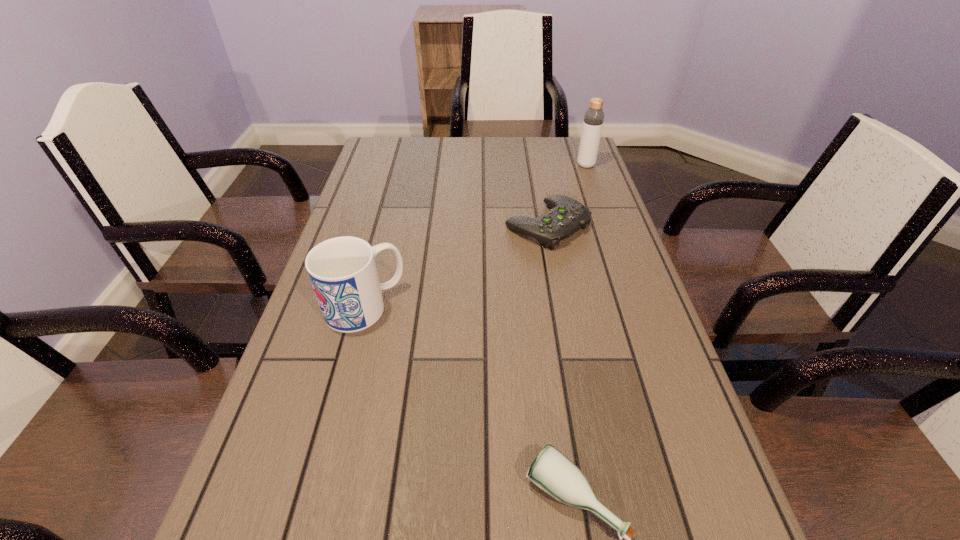
Find the location of a particular element. This screenshot has height=540, width=960. object present at the left edge is located at coordinates (342, 270).

Locate an element on the screen. The width and height of the screenshot is (960, 540). bottle that is at the right edge is located at coordinates coord(593,121).

At what (x,y) coordinates should I click in order to perform the action: click on control located at the right edge. Please return your answer as a coordinate pair (x, y). Looking at the image, I should click on (566, 217).

The width and height of the screenshot is (960, 540). In order to click on object that is positioned at the far right corner in this screenshot , I will do `click(593, 121)`.

In the image, there is a desktop. What are the coordinates of `vacant space at the far edge` in the screenshot? It's located at (465, 152).

Where is `vacant region at the left edge of the desktop`? vacant region at the left edge of the desktop is located at coordinates [280, 485].

In the image, there is a desktop. Where is `vacant region at the right edge`? The image size is (960, 540). vacant region at the right edge is located at coordinates (649, 309).

Locate an element on the screen. Image resolution: width=960 pixels, height=540 pixels. vacant space at the far left corner is located at coordinates (381, 147).

Identify the location of vacant area that lies between the third nearest object and the leftmost object. (456, 266).

The height and width of the screenshot is (540, 960). What are the coordinates of `free space that is in between the second farthest object and the farther bottle` in the screenshot? It's located at (566, 195).